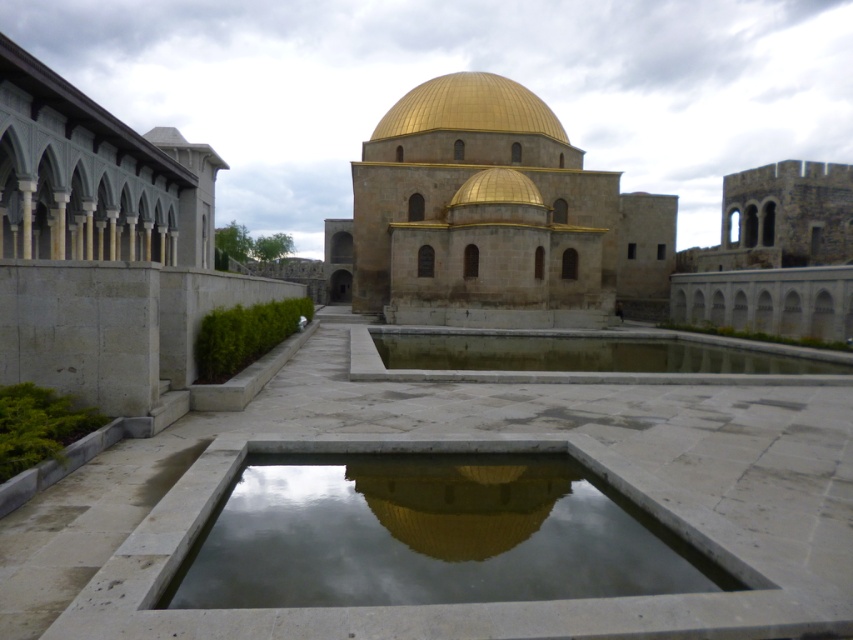
You are standing in front of the mosque and want to take a photo of the gold stone dome at center and the clear stone pond at center. Which object should you focus on first if you want to capture both in a single shot without moving the camera?

You should focus on the gold stone dome at center first because it is positioned over the clear stone pond at center, meaning it is closer to the camera. This allows both objects to be in focus within the same frame.

You are standing in front of the two water basins in the foreground of the scene. You want to take a photo of the gold stone dome at center so that it appears centered in your camera frame. Given the dome is at coordinates 0.333 on the horizontal axis and 0.580 on the vertical axis, should you adjust your camera position to the left or right to center the dome in your photo?

The gold stone dome at center is located at point 0.333 on the horizontal axis, which means it is positioned to the left of the exact center. To center it in your photo, you should move your camera slightly to the right to compensate for the dome being offset to the left.